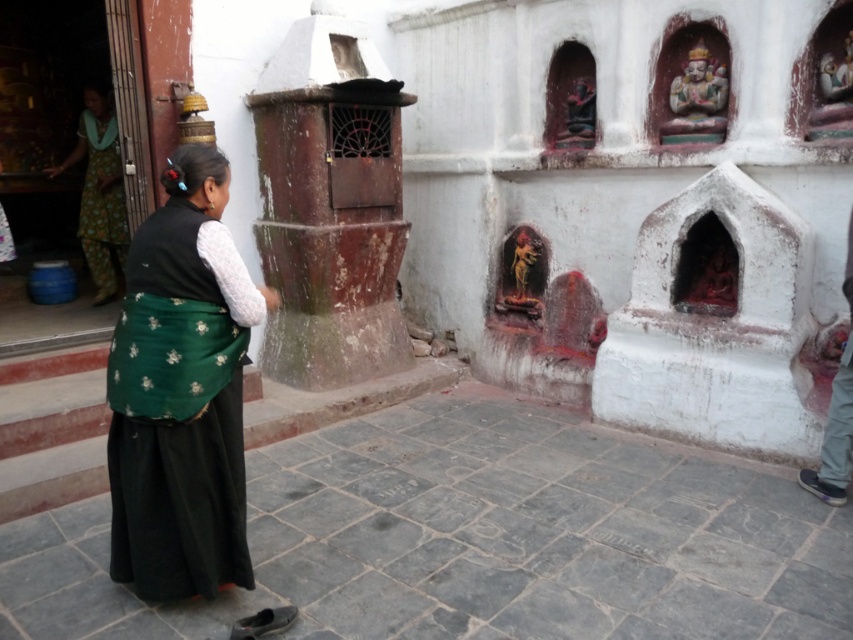
Question: Can you confirm if green floral fabric at center is positioned to the right of green floral fabric at left?

Choices:
 (A) no
 (B) yes

Answer: (B)

Question: Which of the following is the farthest from the observer?

Choices:
 (A) (108, 288)
 (B) (192, 582)

Answer: (A)

Question: Which point is closer to the camera?

Choices:
 (A) green floral fabric at center
 (B) green floral fabric at left

Answer: (A)

Question: Is green floral fabric at center positioned before green floral fabric at left?

Choices:
 (A) yes
 (B) no

Answer: (A)

Question: Does green floral fabric at center appear under green floral fabric at left?

Choices:
 (A) no
 (B) yes

Answer: (B)